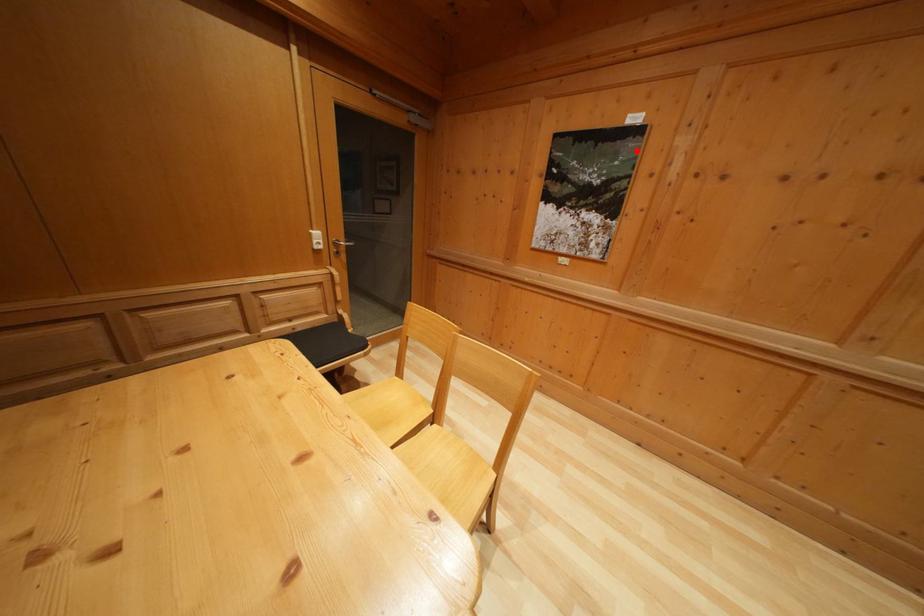
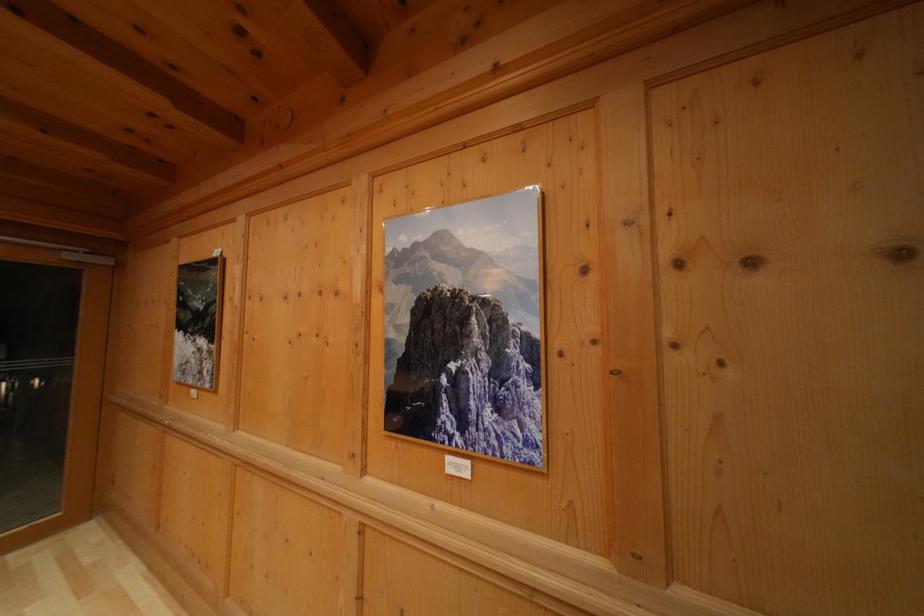
Where in the second image is the point corresponding to the highlighted location from the first image?

(222, 281)